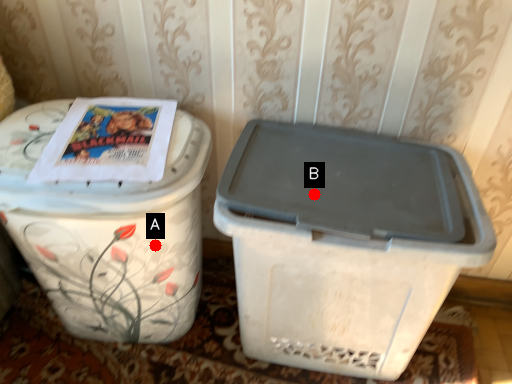
Question: Two points are circled on the image, labeled by A and B beside each circle. Among these points, which one is farthest from the camera?

Choices:
 (A) A is further
 (B) B is further

Answer: (A)